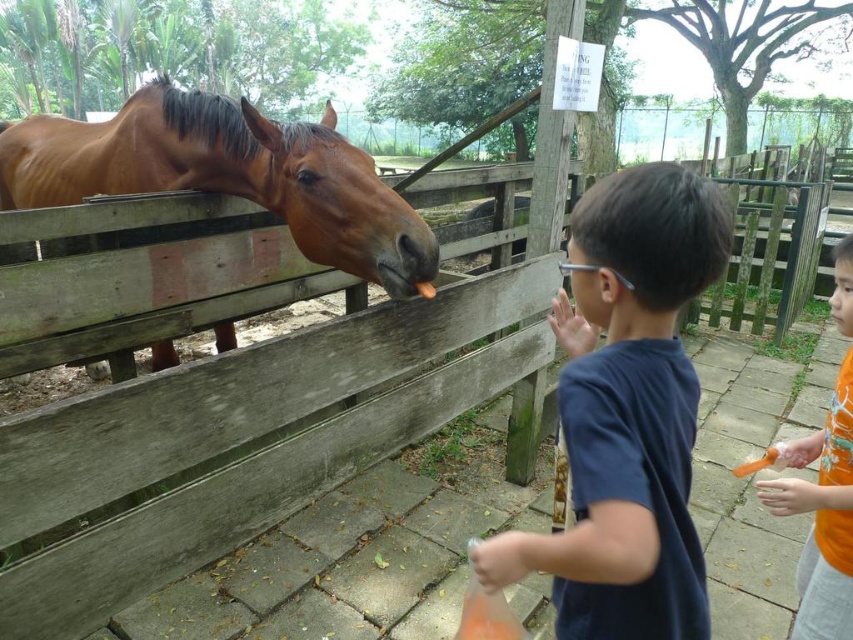
Who is positioned more to the right, dark blue t-shirt at center or brown glossy horse at left?

Positioned to the right is dark blue t-shirt at center.

Is dark blue t-shirt at center shorter than brown glossy horse at left?

Yes.

This screenshot has height=640, width=853. What are the coordinates of `dark blue t-shirt at center` in the screenshot? It's located at (625, 412).

You are a GUI agent. You are given a task and a screenshot of the screen. Output one action in this format:
    pyautogui.click(x=<x>, y=<y>)
    Task: Click on the dark blue t-shirt at center
    
    Given the screenshot: What is the action you would take?
    pyautogui.click(x=625, y=412)

Describe the element at coordinates (227, 176) in the screenshot. The image size is (853, 640). I see `brown glossy horse at left` at that location.

Which is more to the right, brown glossy horse at left or orange fabric shirt at right?

Positioned to the right is orange fabric shirt at right.

Does point (142, 93) come closer to viewer compared to point (833, 637)?

No.

Where is `brown glossy horse at left`? Image resolution: width=853 pixels, height=640 pixels. brown glossy horse at left is located at coordinates (227, 176).

From the picture: Who is higher up, dark blue t-shirt at center or orange fabric shirt at right?

dark blue t-shirt at center is higher up.

Who is lower down, dark blue t-shirt at center or orange fabric shirt at right?

orange fabric shirt at right is lower down.

Which is in front, point (646, 625) or point (830, 554)?

Point (646, 625) is more forward.

At what (x,y) coordinates should I click in order to perform the action: click on dark blue t-shirt at center. Please return your answer as a coordinate pair (x, y). Looking at the image, I should click on (625, 412).